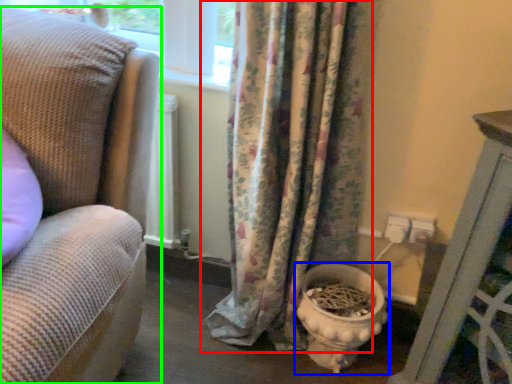
Question: Which object is positioned farthest from curtain (highlighted by a red box)? Select from toilet bowl (highlighted by a blue box) and studio couch (highlighted by a green box).

Choices:
 (A) toilet bowl
 (B) studio couch

Answer: (B)